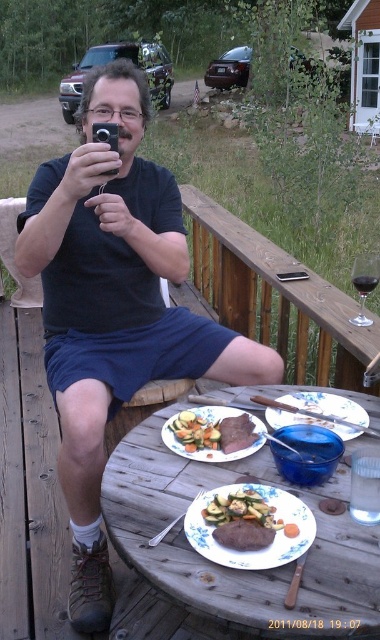
Who is higher up, matte black phone at upper left or golden brown steak at center?

Positioned higher is matte black phone at upper left.

Does matte black phone at upper left lie in front of golden brown steak at center?

That is False.

The image size is (380, 640). Find the location of `matte black phone at upper left`. matte black phone at upper left is located at coordinates (114, 307).

Who is more distant from viewer, (324, 625) or (202, 458)?

The point (202, 458) is behind.

Which is more to the right, wooden table at center or golden brown steak at center?

wooden table at center

Does point (356, 538) come farther from viewer compared to point (216, 444)?

No, (356, 538) is in front of (216, 444).

Find the location of a particular element. This screenshot has height=640, width=380. wooden table at center is located at coordinates (229, 568).

Does point (318, 576) come farther from viewer compared to point (277, 556)?

No.

Is wooden table at center in front of white matte plate at center?

Yes, it is.

This screenshot has width=380, height=640. Identify the location of wooden table at center. (229, 568).